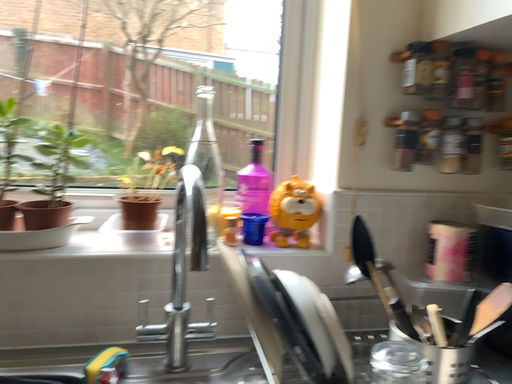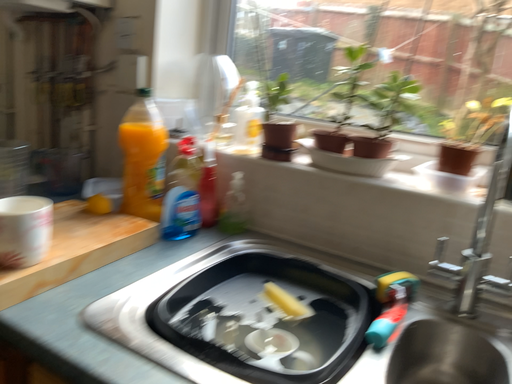
Question: How did the camera likely rotate when shooting the video?

Choices:
 (A) rotated right
 (B) rotated left

Answer: (B)